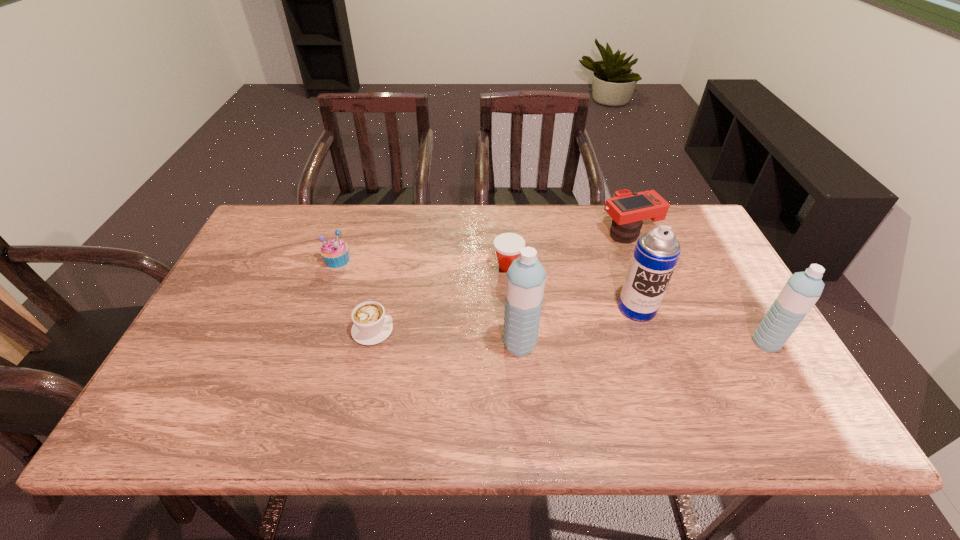
Locate an element on the screen. This screenshot has width=960, height=540. free space located on the back of the left water bottle is located at coordinates (516, 297).

The image size is (960, 540). I want to click on vacant point located on the back of the right water bottle, so click(702, 233).

Find the location of `vacant space located on the left of the camera`. vacant space located on the left of the camera is located at coordinates (555, 234).

Image resolution: width=960 pixels, height=540 pixels. I want to click on vacant space located on the label side of the aerosol can, so click(x=656, y=361).

What are the coordinates of `free space located on the front of the leftmost object` in the screenshot? It's located at (329, 284).

The image size is (960, 540). What are the coordinates of `free space located 0.200m to the right of the cappuccino's handle` in the screenshot? It's located at (474, 330).

Where is `vacant space located on the right of the Dixie cup`? Image resolution: width=960 pixels, height=540 pixels. vacant space located on the right of the Dixie cup is located at coordinates (582, 266).

This screenshot has height=540, width=960. I want to click on object that is at the far edge, so click(628, 210).

In order to click on water bottle that is at the right edge in this screenshot , I will do `click(802, 290)`.

At what (x,y) coordinates should I click in order to perform the action: click on camera that is at the right edge. Please return your answer as a coordinate pair (x, y). The width and height of the screenshot is (960, 540). Looking at the image, I should click on (x=628, y=210).